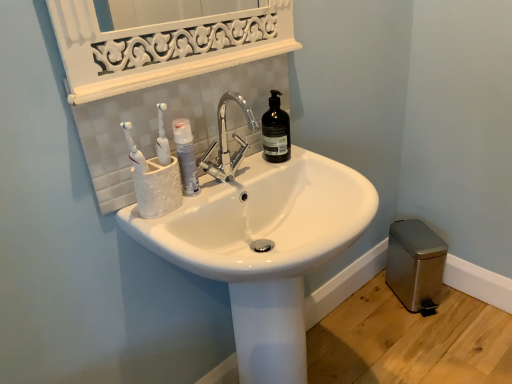
This screenshot has height=384, width=512. In order to click on empty space that is in between black matte bottle at upper center and white glossy mouthwash at center in this screenshot , I will do `click(241, 167)`.